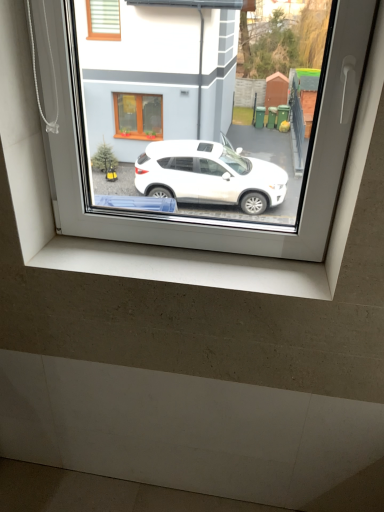
Where is `free point above white concrete window sill at lower center (from a real-world perspective)`? The width and height of the screenshot is (384, 512). free point above white concrete window sill at lower center (from a real-world perspective) is located at coordinates (180, 267).